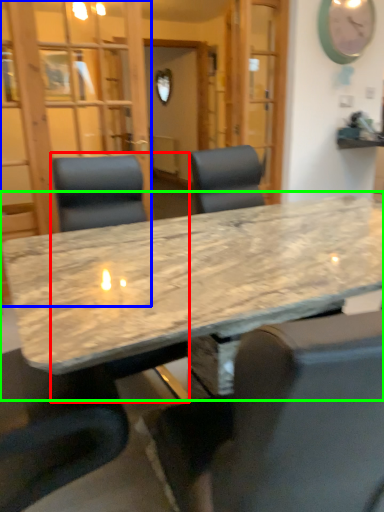
Question: Estimate the real-world distances between objects in this image. Which object is farther from chair (highlighted by a red box), glass door (highlighted by a blue box) or table (highlighted by a green box)?

Choices:
 (A) glass door
 (B) table

Answer: (A)